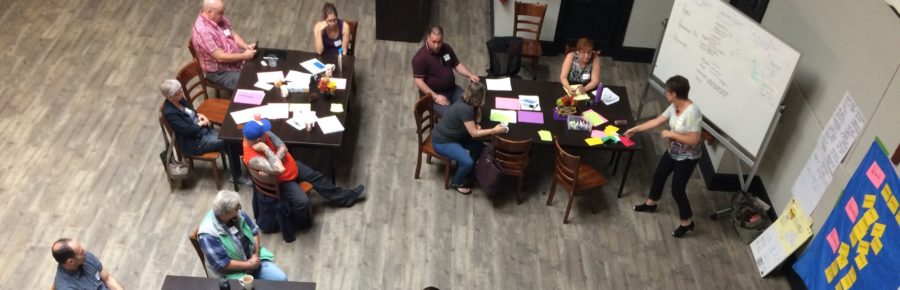
Identify the location of brown chair against wall top center. The image size is (900, 290). (526, 23).